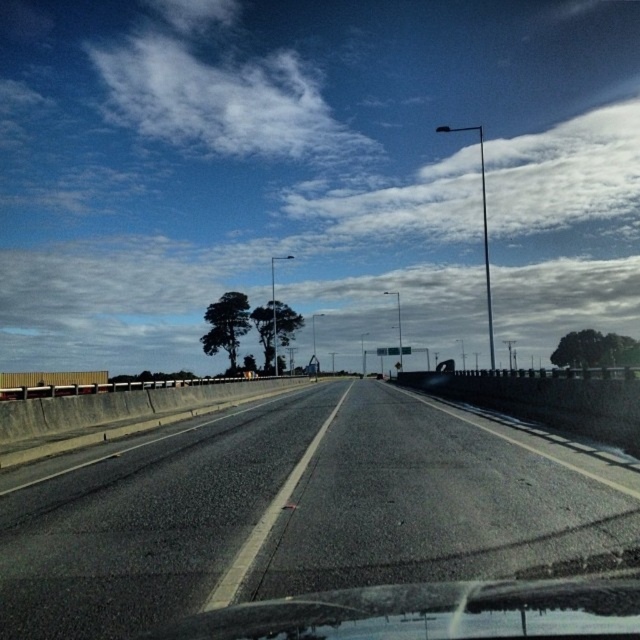
You are driving a car and looking through the transparent glass windshield at lower center. You notice the black asphalt highway at center ahead of you. Which object is bigger in your view?

The black asphalt highway at center is larger in size than the transparent glass windshield at lower center, so the highway appears bigger in your view.